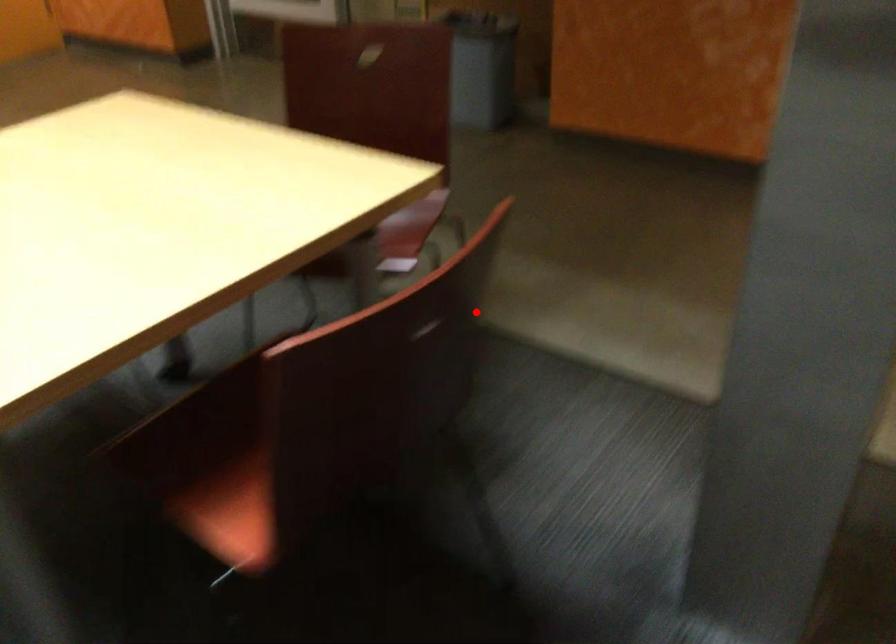
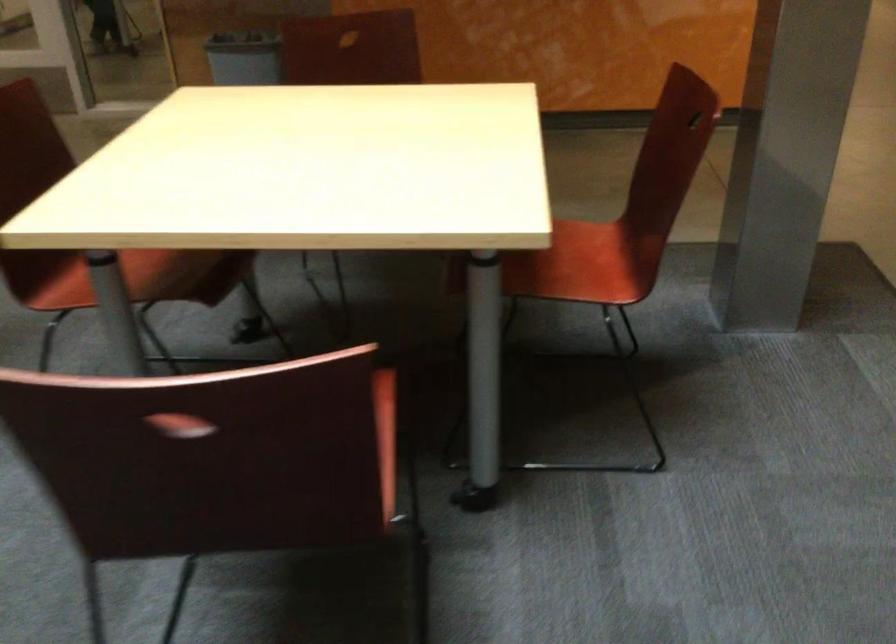
Locate, in the second image, the point that corresponds to the highlighted location in the first image.

(694, 120)